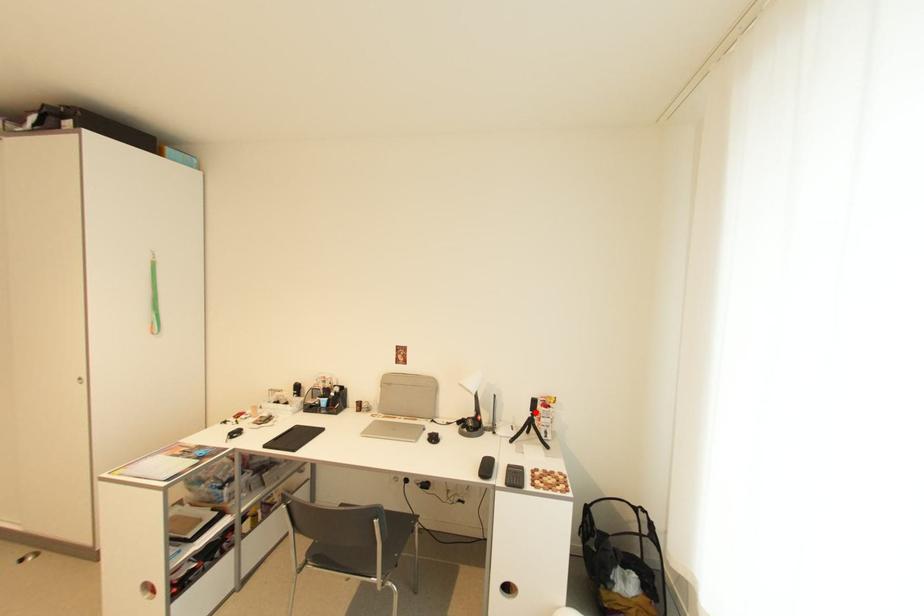
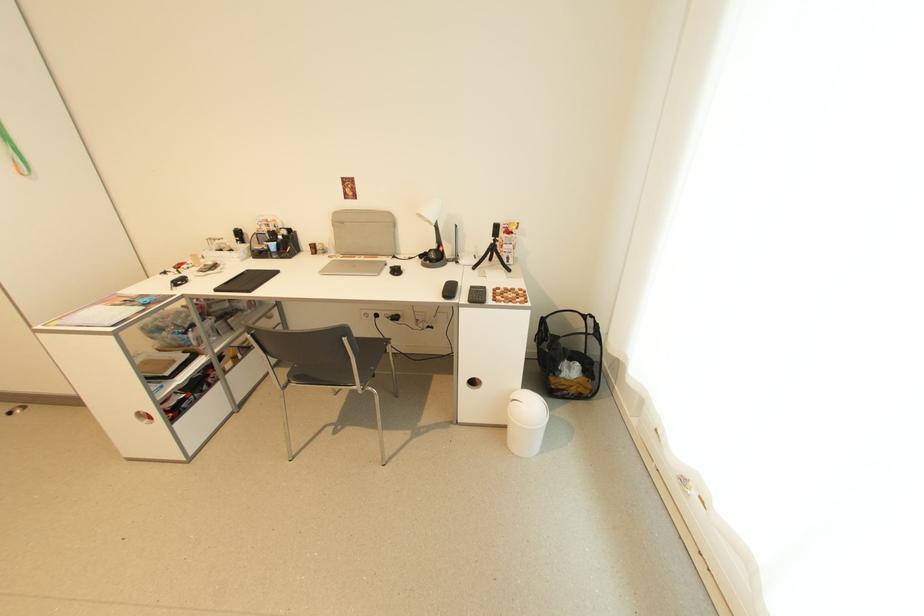
Find the pixel in the second image that matches the highlighted location in the first image.

(497, 238)